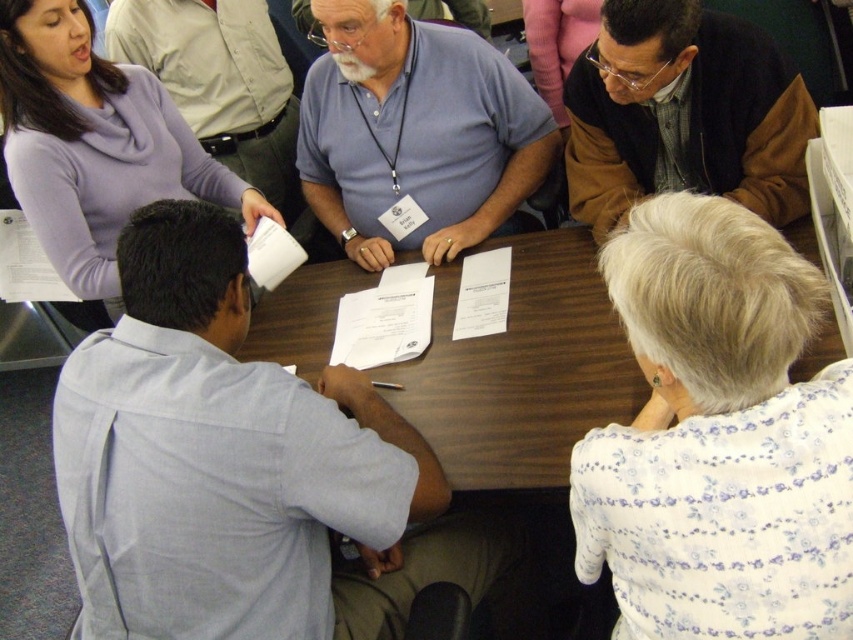
You are attending a meeting and notice two items at the center of the table. Which one is larger in size between the light blue shirt at center and the wooden table at center?

The light blue shirt at center is bigger than the wooden table at center.